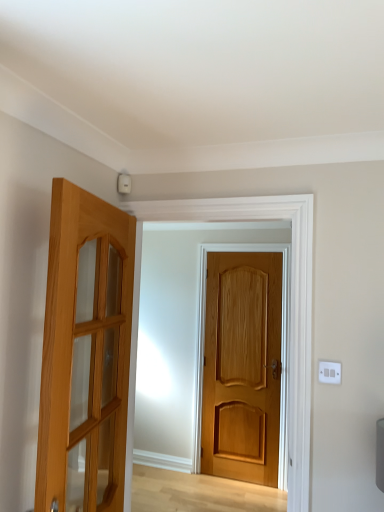
Question: From a real-world perspective, is white plastic switch at upper right located beneath light brown wooden door at center, the 1th door positioned from the back?

Choices:
 (A) no
 (B) yes

Answer: (A)

Question: Considering the relative sizes of white plastic switch at upper right and light brown wooden door at center, arranged as the second door when viewed from the front, in the image provided, is white plastic switch at upper right smaller than light brown wooden door at center, arranged as the second door when viewed from the front,?

Choices:
 (A) yes
 (B) no

Answer: (A)

Question: Does white plastic switch at upper right have a larger size compared to light brown wooden door at center, acting as the 2th door starting from the left?

Choices:
 (A) yes
 (B) no

Answer: (B)

Question: Considering the relative positions of white plastic switch at upper right and light brown wooden door at center, the first door viewed from the right, in the image provided, is white plastic switch at upper right in front of light brown wooden door at center, the first door viewed from the right,?

Choices:
 (A) no
 (B) yes

Answer: (B)

Question: Can you confirm if white plastic switch at upper right is thinner than light brown wooden door at center, acting as the 2th door starting from the left?

Choices:
 (A) yes
 (B) no

Answer: (A)

Question: In terms of height, does light brown wooden door at left, marked as the 2th door in a back-to-front arrangement, look taller or shorter compared to white plastic switch at upper right?

Choices:
 (A) short
 (B) tall

Answer: (B)

Question: Is light brown wooden door at left, which appears as the second door when viewed from the right, wider or thinner than white plastic switch at upper right?

Choices:
 (A) thin
 (B) wide

Answer: (B)

Question: Based on their positions, is light brown wooden door at left, positioned as the first door in left-to-right order, located to the left or right of white plastic switch at upper right?

Choices:
 (A) left
 (B) right

Answer: (A)

Question: Considering their positions, is light brown wooden door at left, placed as the 1th door when sorted from front to back, located in front of or behind white plastic switch at upper right?

Choices:
 (A) behind
 (B) front

Answer: (B)

Question: Is point (322, 373) positioned closer to the camera than point (254, 409)?

Choices:
 (A) closer
 (B) farther

Answer: (A)

Question: From a real-world perspective, is white plastic switch at upper right above or below light brown wooden door at center, arranged as the second door when viewed from the front?

Choices:
 (A) above
 (B) below

Answer: (A)

Question: Would you say white plastic switch at upper right is to the left or to the right of light brown wooden door at center, the first door viewed from the right, in the picture?

Choices:
 (A) right
 (B) left

Answer: (A)

Question: In terms of width, does white plastic switch at upper right look wider or thinner when compared to light brown wooden door at center, acting as the 2th door starting from the left?

Choices:
 (A) wide
 (B) thin

Answer: (B)

Question: In terms of height, does light brown wooden door at center, the first door viewed from the right, look taller or shorter compared to white plastic switch at upper right?

Choices:
 (A) tall
 (B) short

Answer: (A)

Question: Would you say light brown wooden door at center, the first door viewed from the right, is to the left or to the right of white plastic switch at upper right in the picture?

Choices:
 (A) right
 (B) left

Answer: (B)